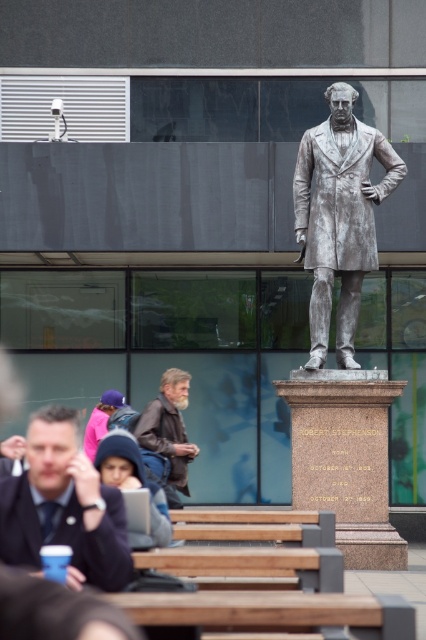
Who is more forward, (294, 211) or (158, 410)?

Point (158, 410)

Is point (305, 147) less distant than point (141, 413)?

No, it is not.

Which is behind, point (351, 144) or point (141, 416)?

The point (351, 144) is behind.

Identify the location of polished silver statue at center. This screenshot has height=640, width=426. (339, 216).

Is polished silver statue at center to the left of matte black jacket at lower left from the viewer's perspective?

No, polished silver statue at center is not to the left of matte black jacket at lower left.

Is point (322, 340) positioned in front of point (60, 536)?

No, (322, 340) is behind (60, 536).

The width and height of the screenshot is (426, 640). What are the coordinates of `polished silver statue at center` in the screenshot? It's located at (339, 216).

Can you confirm if matte black jacket at lower left is positioned to the right of brown leather jacket at lower center?

Incorrect, matte black jacket at lower left is not on the right side of brown leather jacket at lower center.

Locate an element on the screen. This screenshot has width=426, height=640. matte black jacket at lower left is located at coordinates (63, 506).